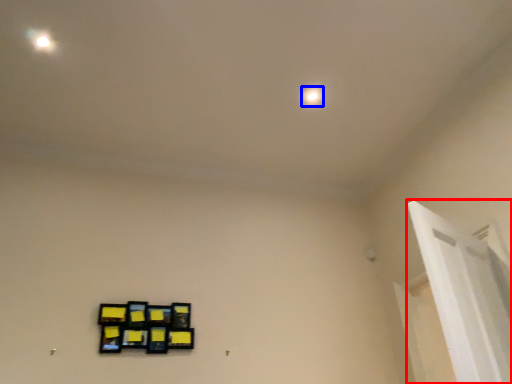
Question: Which of the following is the closest to the observer, window frame (highlighted by a red box) or dot (highlighted by a blue box)?

Choices:
 (A) window frame
 (B) dot

Answer: (A)